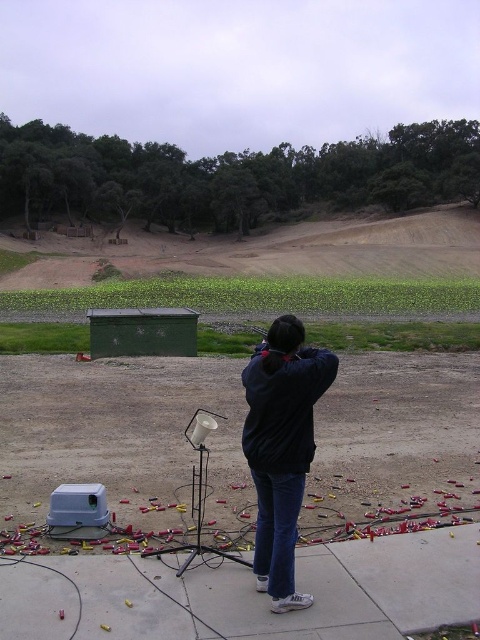
Question: Can you confirm if brown dirt field at upper center is positioned to the left of dark blue jacket at center?

Choices:
 (A) no
 (B) yes

Answer: (B)

Question: Can you confirm if brown dirt field at upper center is smaller than dark blue jacket at center?

Choices:
 (A) no
 (B) yes

Answer: (A)

Question: Can you confirm if brown dirt field at upper center is thinner than dark blue jacket at center?

Choices:
 (A) no
 (B) yes

Answer: (A)

Question: Among these points, which one is farthest from the camera?

Choices:
 (A) (350, 243)
 (B) (312, 372)

Answer: (A)